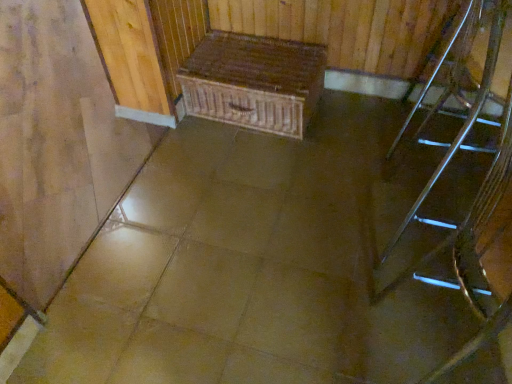
Locate an element on the screen. The image size is (512, 384). free space below metallic silver stairs at right (from a real-world perspective) is located at coordinates (425, 227).